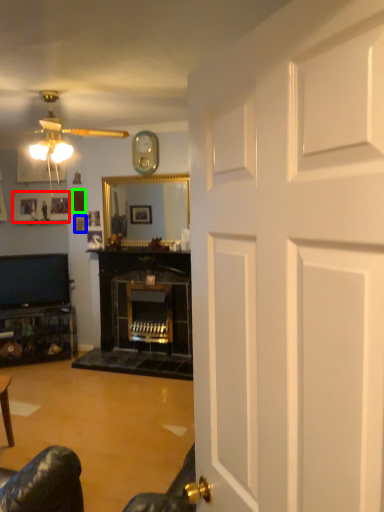
Question: Which object is the closest to the picture frame (highlighted by a red box)? Choose among these: picture frame (highlighted by a blue box) or picture frame (highlighted by a green box).

Choices:
 (A) picture frame
 (B) picture frame

Answer: (B)